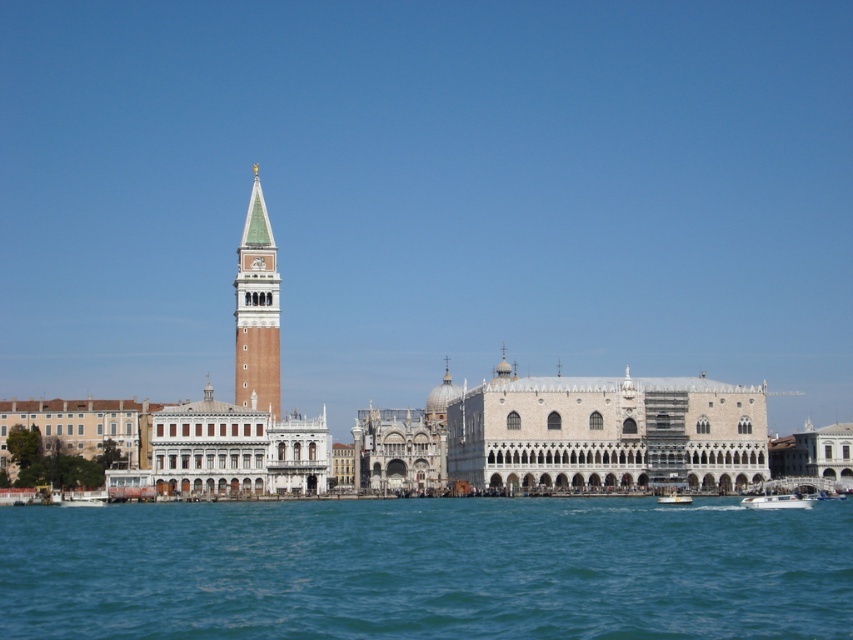
Question: Estimate the real-world distances between objects in this image. Which object is farther from the white plastic boat at lower right?

Choices:
 (A) blue water at lower center
 (B) white glossy boat at lower right
 (C) green-tiled bell tower at center-left

Answer: (C)

Question: Does blue water at lower center appear under white glossy boat at lower right?

Choices:
 (A) yes
 (B) no

Answer: (B)

Question: Does blue water at lower center have a lesser width compared to green-tiled bell tower at center-left?

Choices:
 (A) no
 (B) yes

Answer: (A)

Question: Among these objects, which one is farthest from the camera?

Choices:
 (A) green-tiled bell tower at center-left
 (B) white glossy boat at lower right
 (C) blue water at lower center
 (D) white plastic boat at lower right

Answer: (D)

Question: Among these objects, which one is nearest to the camera?

Choices:
 (A) green-tiled bell tower at center-left
 (B) white plastic boat at lower right
 (C) white glossy boat at lower right
 (D) blue water at lower center

Answer: (D)

Question: Does blue water at lower center appear on the left side of white plastic boat at lower right?

Choices:
 (A) no
 (B) yes

Answer: (B)